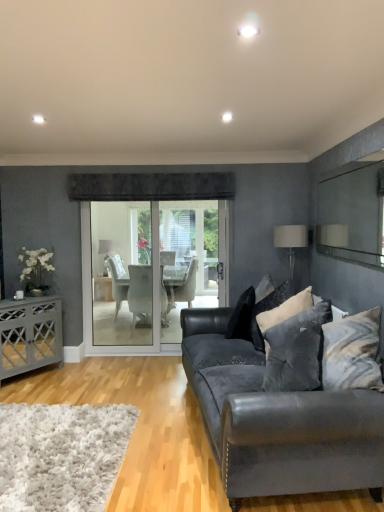
Question: Is white silk flower at left located within velvet black pillow at center, the 2th pillow viewed from the back?

Choices:
 (A) no
 (B) yes

Answer: (A)

Question: Considering the relative sizes of velvet black pillow at center, which is the third pillow from front to back, and white silk flower at left in the image provided, is velvet black pillow at center, which is the third pillow from front to back, smaller than white silk flower at left?

Choices:
 (A) no
 (B) yes

Answer: (A)

Question: Is velvet black pillow at center, which is the third pillow from front to back, further to camera compared to white silk flower at left?

Choices:
 (A) yes
 (B) no

Answer: (B)

Question: Is velvet black pillow at center, which is the third pillow from front to back, positioned with its back to white silk flower at left?

Choices:
 (A) no
 (B) yes

Answer: (A)

Question: Is there a large distance between velvet black pillow at center, the 2th pillow viewed from the back, and white silk flower at left?

Choices:
 (A) no
 (B) yes

Answer: (B)

Question: Is white fabric lampshade at upper right, arranged as the 2th lamp when viewed from the back, taller or shorter than dark gray textured pillow at center right, the 1th pillow positioned from the front?

Choices:
 (A) short
 (B) tall

Answer: (A)

Question: Does point (276, 229) appear closer or farther from the camera than point (312, 380)?

Choices:
 (A) closer
 (B) farther

Answer: (B)

Question: Considering the positions of white fabric lampshade at upper right, which is the 1th lamp in right-to-left order, and dark gray textured pillow at center right, the 1th pillow positioned from the front, in the image, is white fabric lampshade at upper right, which is the 1th lamp in right-to-left order, wider or thinner than dark gray textured pillow at center right, the 1th pillow positioned from the front,?

Choices:
 (A) wide
 (B) thin

Answer: (B)

Question: Is white fabric lampshade at upper right, the 1th lamp from the front, bigger or smaller than dark gray textured pillow at center right, the 1th pillow positioned from the front?

Choices:
 (A) big
 (B) small

Answer: (B)

Question: Visually, is white silk flower at left positioned to the left or to the right of matte gray cabinet at left?

Choices:
 (A) left
 (B) right

Answer: (B)

Question: From a real-world perspective, is white silk flower at left above or below matte gray cabinet at left?

Choices:
 (A) above
 (B) below

Answer: (A)

Question: Is point (23, 262) closer or farther from the camera than point (13, 360)?

Choices:
 (A) farther
 (B) closer

Answer: (A)

Question: Is white silk flower at left spatially inside matte gray cabinet at left, or outside of it?

Choices:
 (A) inside
 (B) outside

Answer: (B)

Question: From the image's perspective, relative to black velvet pillow at center, acting as the 1th pillow starting from the back, is velvet black pillow at center, the 2th pillow viewed from the back, above or below?

Choices:
 (A) above
 (B) below

Answer: (A)

Question: In the image, is velvet black pillow at center, the 2th pillow viewed from the back, positioned in front of or behind black velvet pillow at center, acting as the 1th pillow starting from the back?

Choices:
 (A) behind
 (B) front

Answer: (B)